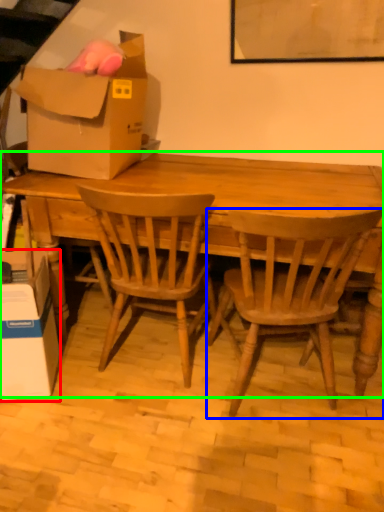
Question: Based on their relative distances, which object is farther from box (highlighted by a red box)? Choose from chair (highlighted by a blue box) and desk (highlighted by a green box).

Choices:
 (A) chair
 (B) desk

Answer: (A)